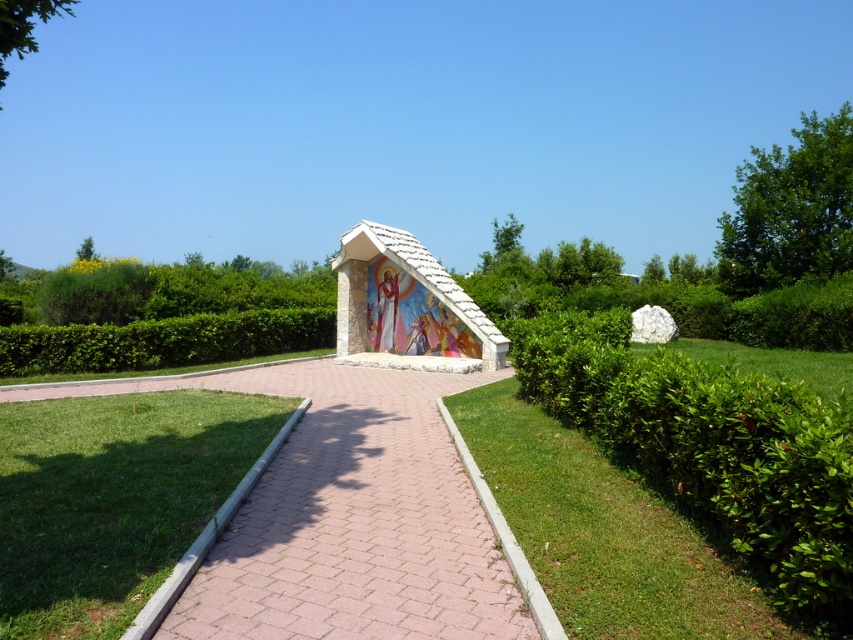
Who is lower down, white stone shrine at center or green leafy hedge at center?

green leafy hedge at center

Does white stone shrine at center have a lesser height compared to green leafy hedge at center?

Incorrect, white stone shrine at center's height does not fall short of green leafy hedge at center's.

Based on the photo, who is more distant from viewer, [579,426] or [57,355]?

The point [57,355] is behind.

Where is `white stone shrine at center`? The height and width of the screenshot is (640, 853). white stone shrine at center is located at coordinates (643, 413).

Who is higher up, pink brick path at center or white stone shrine at center?

white stone shrine at center

Is pink brick path at center above white stone shrine at center?

Incorrect, pink brick path at center is not positioned above white stone shrine at center.

Who is more distant from viewer, (x=437, y=632) or (x=611, y=436)?

The point (x=611, y=436) is behind.

Where is `pink brick path at center`? The image size is (853, 640). pink brick path at center is located at coordinates (355, 520).

Which is below, white stone shrine at center or green grass at lower left?

Positioned lower is green grass at lower left.

Does point (535, 328) come in front of point (183, 392)?

Yes, it is in front of point (183, 392).

This screenshot has height=640, width=853. Identify the location of white stone shrine at center. (643, 413).